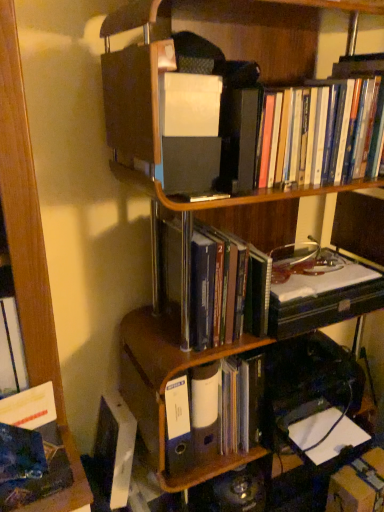
Question: Does point (178, 373) appear closer or farther from the camera than point (334, 477)?

Choices:
 (A) farther
 (B) closer

Answer: (B)

Question: Visually, is blue plastic ring binder at center positioned to the left or to the right of cardboard box at lower right?

Choices:
 (A) left
 (B) right

Answer: (A)

Question: Based on their relative distances, which object is farther from the cardboard box at lower right?

Choices:
 (A) hardcover books at center, acting as the 2th book starting from the bottom
 (B) matte plastic binder at center, placed as the third book when sorted from top to bottom
 (C) blue plastic ring binder at center
 (D) hardcover books at upper right, the third book from the bottom

Answer: (D)

Question: Based on their relative distances, which object is nearer to the matte plastic binder at center, the first book when ordered from bottom to top?

Choices:
 (A) blue plastic ring binder at center
 (B) cardboard box at lower right
 (C) hardcover books at upper right, which appears as the first book when viewed from the top
 (D) hardcover books at center, which ranks as the 2th book in top-to-bottom order

Answer: (A)